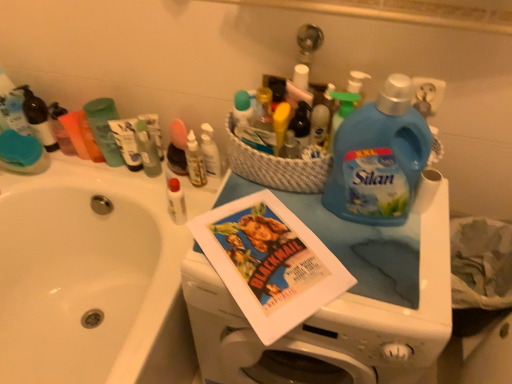
At what (x,y) coordinates should I click in order to perform the action: click on vacant space that is to the left of green plastic shampoo bottle at upper left, the 2th toiletry positioned from the left. Please return your answer as a coordinate pair (x, y). The image size is (512, 384). Looking at the image, I should click on (57, 174).